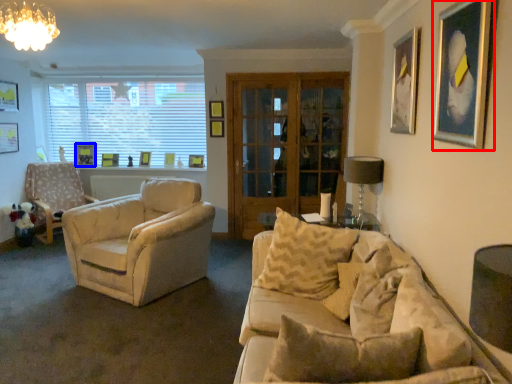
Question: Which of the following is the farthest to the observer, picture frame (highlighted by a red box) or picture frame (highlighted by a blue box)?

Choices:
 (A) picture frame
 (B) picture frame

Answer: (B)